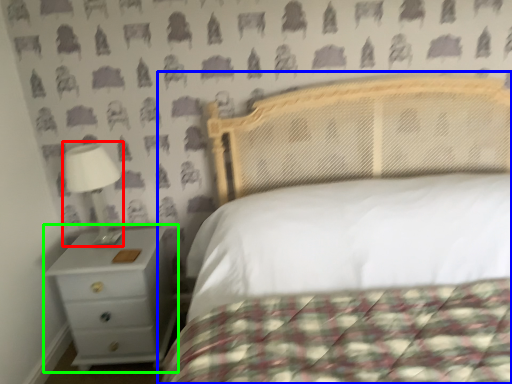
Question: Based on their relative distances, which object is nearer to lamp (highlighted by a red box)? Choose from bed (highlighted by a blue box) and nightstand (highlighted by a green box).

Choices:
 (A) bed
 (B) nightstand

Answer: (B)